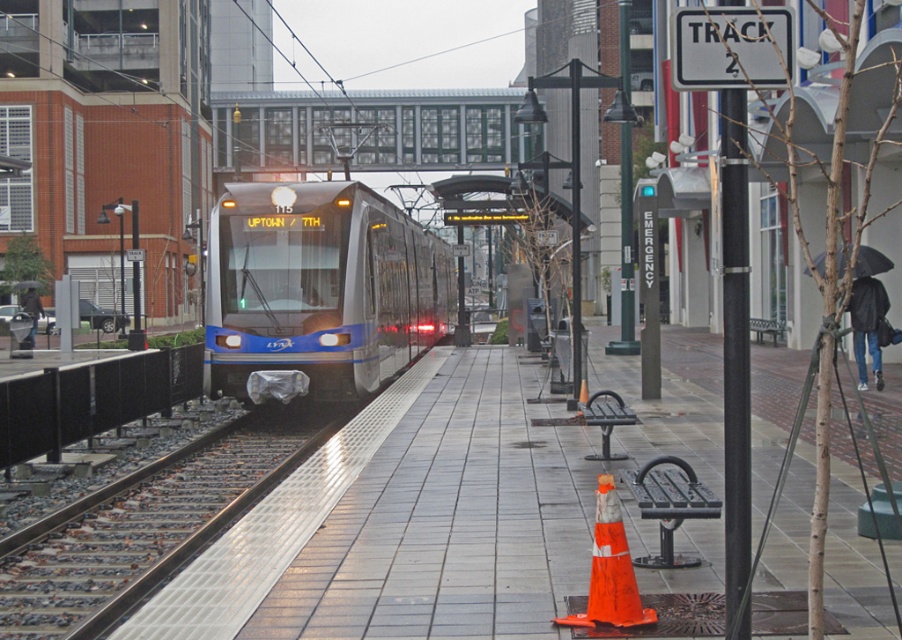
Question: Which is nearer to the metal/textured track at lower left?

Choices:
 (A) orange matte traffic cone at lower center
 (B) silver metallic train at center

Answer: (A)

Question: Is silver metallic train at center closer to camera compared to orange matte traffic cone at lower center?

Choices:
 (A) no
 (B) yes

Answer: (A)

Question: Can you confirm if silver metallic train at center is bigger than orange matte traffic cone at lower center?

Choices:
 (A) no
 (B) yes

Answer: (B)

Question: Which point appears farthest from the camera in this image?

Choices:
 (A) 305,408
 (B) 594,540
 (C) 241,230

Answer: (A)

Question: Can you confirm if silver metallic train at center is positioned to the right of orange matte traffic cone at lower center?

Choices:
 (A) yes
 (B) no

Answer: (B)

Question: Estimate the real-world distances between objects in this image. Which object is farther from the silver metallic train at center?

Choices:
 (A) orange matte traffic cone at lower center
 (B) metal/textured track at lower left

Answer: (A)